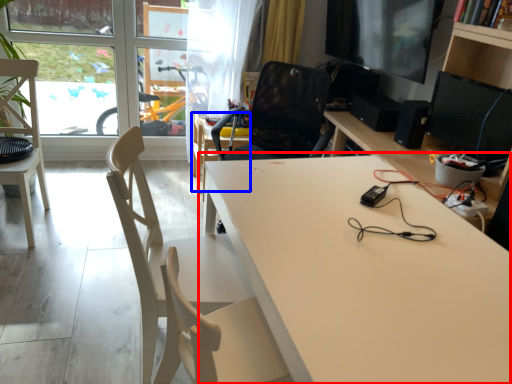
Question: Which object is further to the camera taking this photo, table (highlighted by a red box) or table (highlighted by a blue box)?

Choices:
 (A) table
 (B) table

Answer: (B)